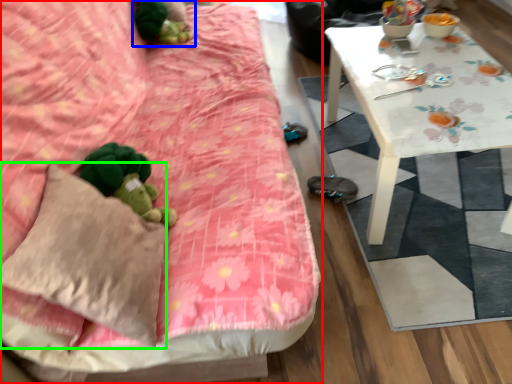
Question: Based on their relative distances, which object is nearer to studio couch (highlighted by a red box)? Choose from miniature (highlighted by a blue box) and throw pillow (highlighted by a green box).

Choices:
 (A) miniature
 (B) throw pillow

Answer: (B)